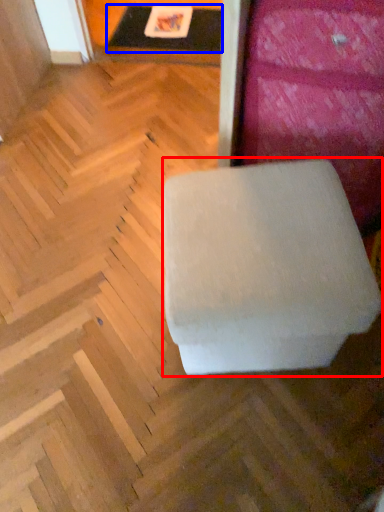
Question: Which object is closer to the camera taking this photo, furniture (highlighted by a red box) or table (highlighted by a blue box)?

Choices:
 (A) furniture
 (B) table

Answer: (A)